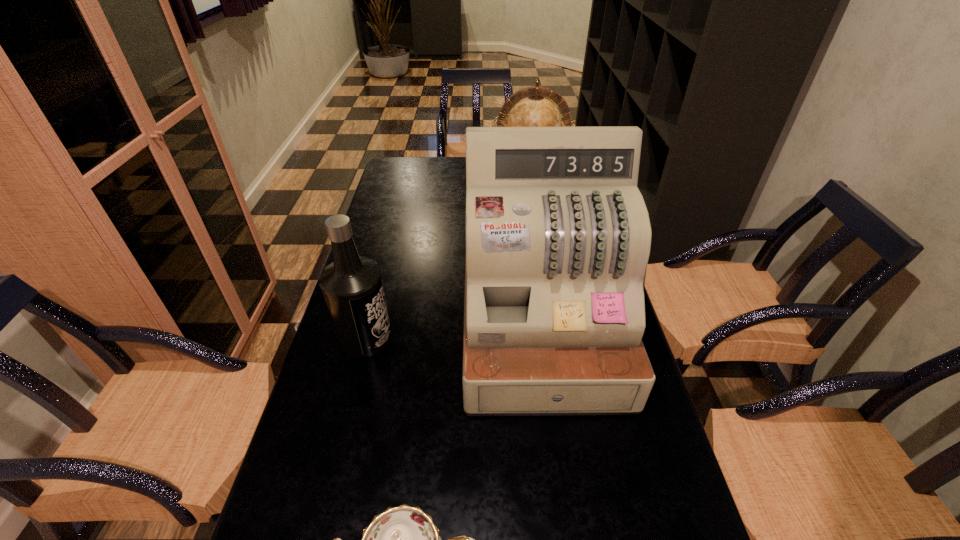
You are a GUI agent. You are given a task and a screenshot of the screen. Output one action in this format:
    pyautogui.click(x=<x>, y=<y>)
    Task: Click on the free region that satisfies the following two spatial constraints: 1. on the front-facing side of the farthest object; 2. on the front label of the liquor
    
    Given the screenshot: What is the action you would take?
    pyautogui.click(x=557, y=338)

The height and width of the screenshot is (540, 960). I want to click on free spot that satisfies the following two spatial constraints: 1. on the front-facing side of the globe; 2. on the front label of the liquor, so click(557, 338).